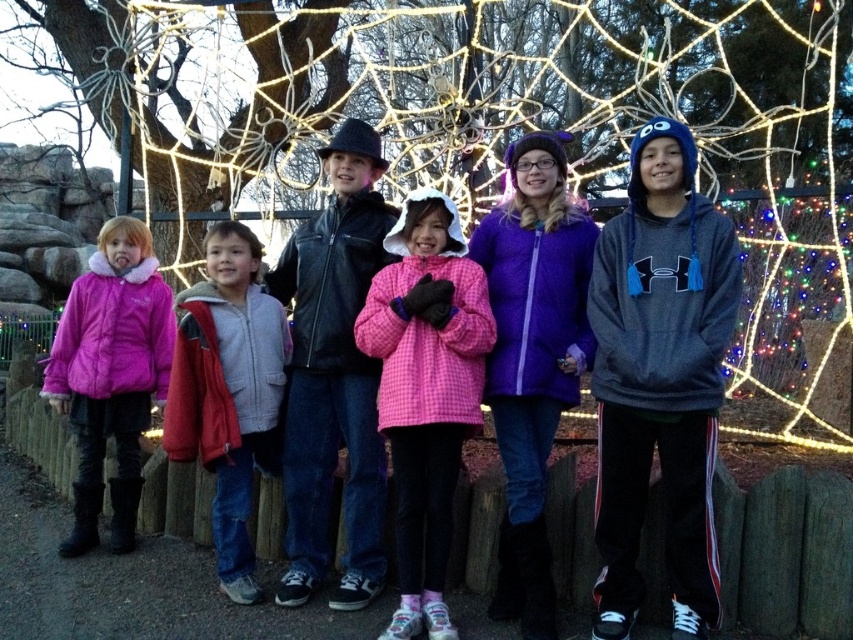
Question: Does pink fleece jacket at center appear on the right side of red fleece jacket at center?

Choices:
 (A) yes
 (B) no

Answer: (A)

Question: Which object is the farthest from the pink puffy jacket at left?

Choices:
 (A) black leather jacket at center
 (B) pink checkered jacket at center
 (C) red fleece jacket at center

Answer: (B)

Question: Does gray fleece hoodie at center come in front of wooden fence at lower center?

Choices:
 (A) yes
 (B) no

Answer: (A)

Question: Can you confirm if pink fleece jacket at center is smaller than wooden fence at lower center?

Choices:
 (A) yes
 (B) no

Answer: (B)

Question: Which of the following is the closest to the observer?

Choices:
 (A) black leather jacket at center
 (B) gray fleece hoodie at center

Answer: (B)

Question: Which object appears closest to the camera in this image?

Choices:
 (A) gray fleece hoodie at center
 (B) pink fleece jacket at center
 (C) black leather jacket at center
 (D) pink checkered jacket at center

Answer: (A)